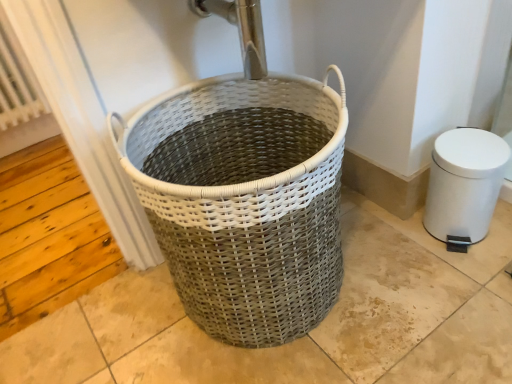
Question: In terms of height, does white textured radiator at left look taller or shorter compared to white plastic bidet at right?

Choices:
 (A) tall
 (B) short

Answer: (A)

Question: Looking at the image, does white textured radiator at left seem bigger or smaller compared to white plastic bidet at right?

Choices:
 (A) big
 (B) small

Answer: (A)

Question: Which is farther from the white woven basket at center?

Choices:
 (A) white textured radiator at left
 (B) white plastic bidet at right

Answer: (A)

Question: Which of these objects is positioned closest to the white plastic bidet at right?

Choices:
 (A) white textured radiator at left
 (B) white woven basket at center

Answer: (B)